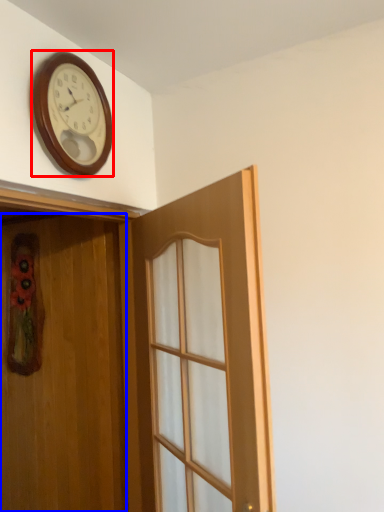
Question: Which object is closer to the camera taking this photo, wall clock (highlighted by a red box) or door (highlighted by a blue box)?

Choices:
 (A) wall clock
 (B) door

Answer: (B)